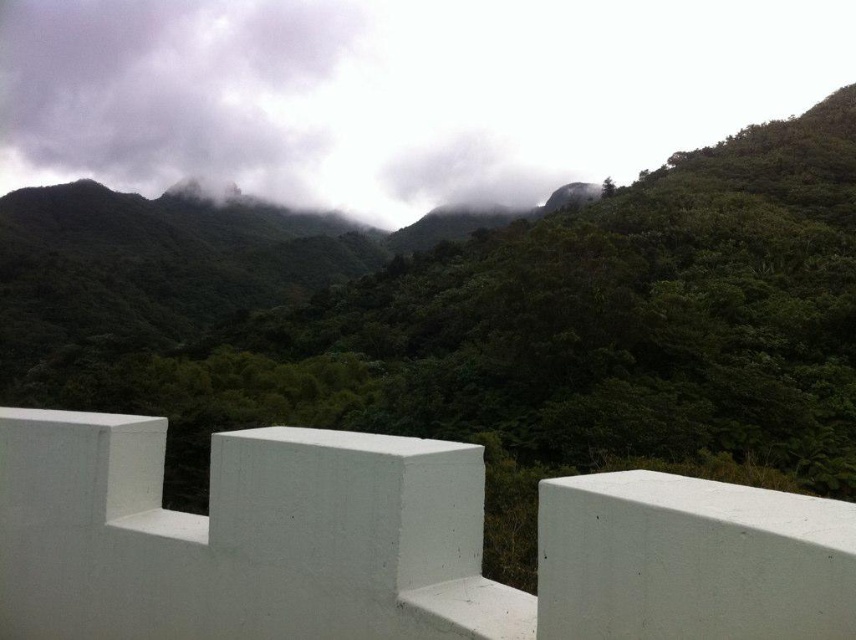
You are standing on the balcony with a drone that has a maximum flight range of 180 feet. You want to fly the drone to the point at point (846, 294). Will the drone be able to reach that point without exceeding its range?

The distance between you and the point at point (846, 294) is 184.55 feet, which exceeds the drone maximum flight range of 180 feet. The drone will not be able to reach that point without exceeding its range.

Consider the image. You are standing on the balcony with the white, low profile railing in the foreground. You notice a specific point in the scene labeled as point (544, 330). What is located at that point?

At point (544, 330) lies green matte forest at upper center.

You are an architect designing a new eco lodge and are analyzing this view. Which object in the scene takes up more visual space, the green matte forest at upper center or the dark gray cloud at upper left?

The green matte forest at upper center takes up more visual space than the dark gray cloud at upper left as it is bigger in size according to the description.